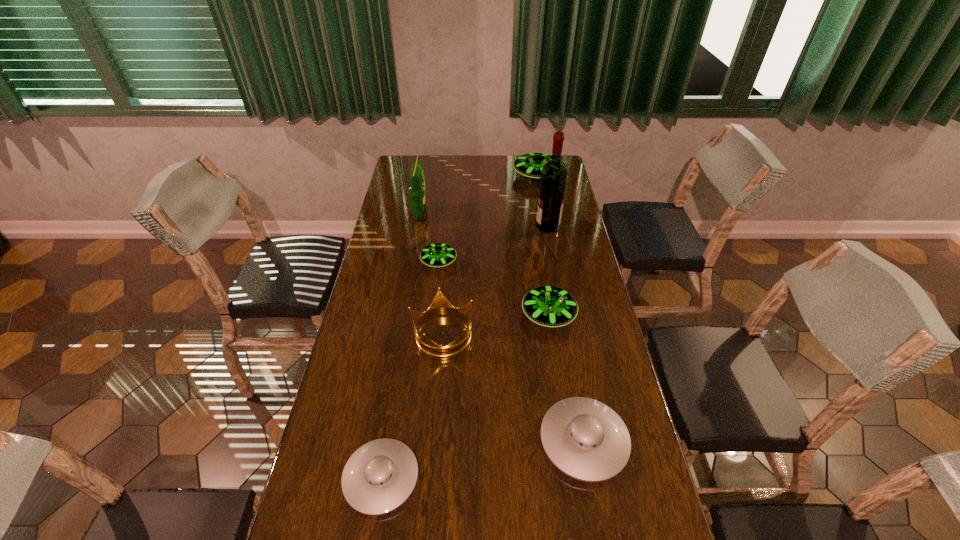
This screenshot has height=540, width=960. Find the location of `blank space that satisfies the following two spatial constraints: 1. on the back side of the farthest green saucer; 2. on the right side of the crown`. blank space that satisfies the following two spatial constraints: 1. on the back side of the farthest green saucer; 2. on the right side of the crown is located at coordinates (455, 176).

Where is `vacant space that satisfies the following two spatial constraints: 1. on the front-facing side of the green crisp (potato chip); 2. on the right side of the gold crown`? vacant space that satisfies the following two spatial constraints: 1. on the front-facing side of the green crisp (potato chip); 2. on the right side of the gold crown is located at coordinates (399, 334).

Image resolution: width=960 pixels, height=540 pixels. I want to click on free space that satisfies the following two spatial constraints: 1. on the back side of the crown; 2. on the right side of the smaller gray saucer, so click(x=405, y=334).

Where is `blank space that satisfies the following two spatial constraints: 1. on the back side of the smallest green saucer; 2. on the right side of the smaller gray saucer`? The height and width of the screenshot is (540, 960). blank space that satisfies the following two spatial constraints: 1. on the back side of the smallest green saucer; 2. on the right side of the smaller gray saucer is located at coordinates (417, 262).